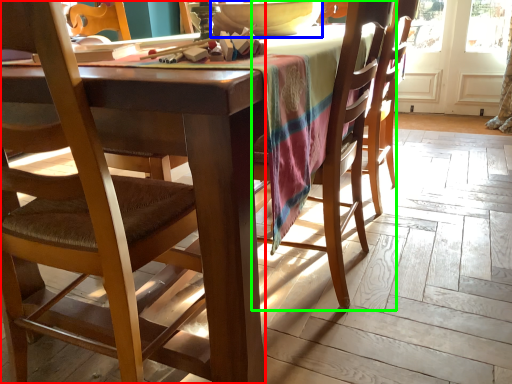
Question: Which object is positioned farthest from chair (highlighted by a red box)? Select from bowl (highlighted by a blue box) and chair (highlighted by a green box).

Choices:
 (A) bowl
 (B) chair

Answer: (A)